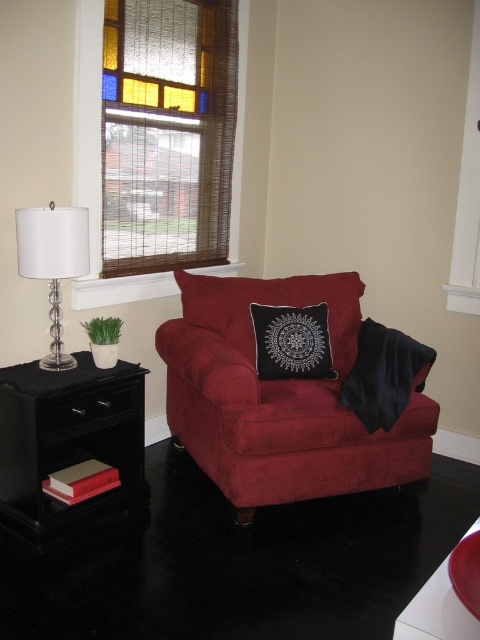
Does point (268, 355) come behind point (412, 627)?

Yes, point (268, 355) is behind point (412, 627).

Is black velvet pillow at center thinner than red glossy bowl at lower right?

No.

Does point (327, 368) come farther from viewer compared to point (475, 632)?

That is True.

The image size is (480, 640). In order to click on black velvet pillow at center in this screenshot , I will do `click(291, 340)`.

Does suede-like red armchair at center have a greater width compared to red glossy bowl at lower right?

Yes.

Is suede-like red armchair at center behind red glossy bowl at lower right?

Yes, it is.

Locate an element on the screen. The height and width of the screenshot is (640, 480). suede-like red armchair at center is located at coordinates (280, 396).

Consider the image. Can you confirm if suede-like red armchair at center is positioned to the right of clear glass lamp at left?

Indeed, suede-like red armchair at center is positioned on the right side of clear glass lamp at left.

Is point (276, 403) in front of point (47, 216)?

No.

This screenshot has height=640, width=480. What do you see at coordinates (280, 396) in the screenshot?
I see `suede-like red armchair at center` at bounding box center [280, 396].

The height and width of the screenshot is (640, 480). I want to click on suede-like red armchair at center, so click(x=280, y=396).